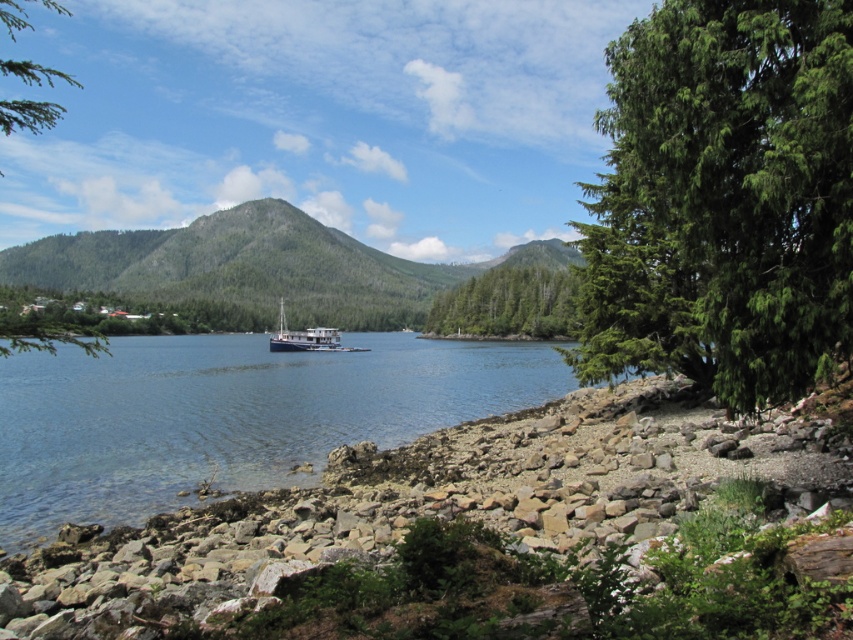
Question: Considering the relative positions of clear blue water at center and blue matte boat at center in the image provided, where is clear blue water at center located with respect to blue matte boat at center?

Choices:
 (A) below
 (B) above

Answer: (A)

Question: Among these objects, which one is farthest from the camera?

Choices:
 (A) green forested mountain at center
 (B) blue matte boat at center

Answer: (A)

Question: Does green forested mountain at center have a larger size compared to green textured tree at center?

Choices:
 (A) no
 (B) yes

Answer: (B)

Question: Which point is closer to the camera?

Choices:
 (A) green leafy tree at right
 (B) clear blue water at center

Answer: (A)

Question: Which object appears closest to the camera in this image?

Choices:
 (A) blue matte boat at center
 (B) green leafy tree at right
 (C) green textured tree at center

Answer: (B)

Question: Where is green leafy tree at right located in relation to green matte tree at upper left in the image?

Choices:
 (A) below
 (B) above

Answer: (A)